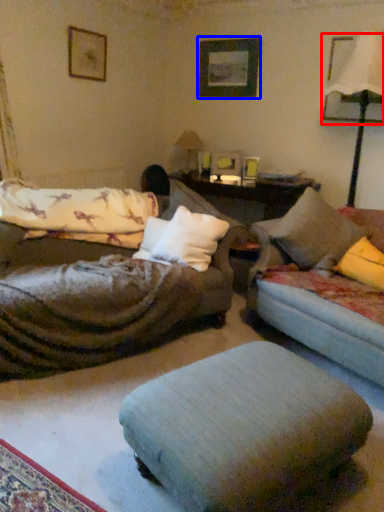
Question: Which point is closer to the camera, picture frame (highlighted by a red box) or picture frame (highlighted by a blue box)?

Choices:
 (A) picture frame
 (B) picture frame

Answer: (A)